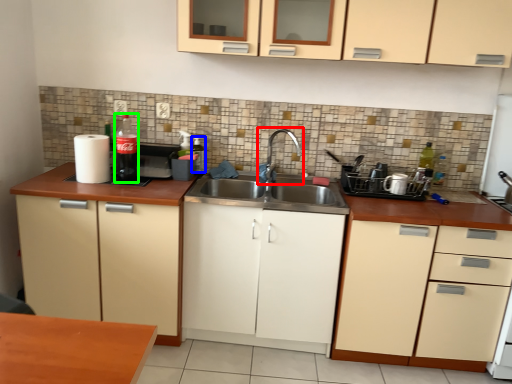
Question: Based on their relative distances, which object is nearer to tap (highlighted by a red box)? Choose from bottle (highlighted by a blue box) and bottle (highlighted by a green box).

Choices:
 (A) bottle
 (B) bottle

Answer: (A)